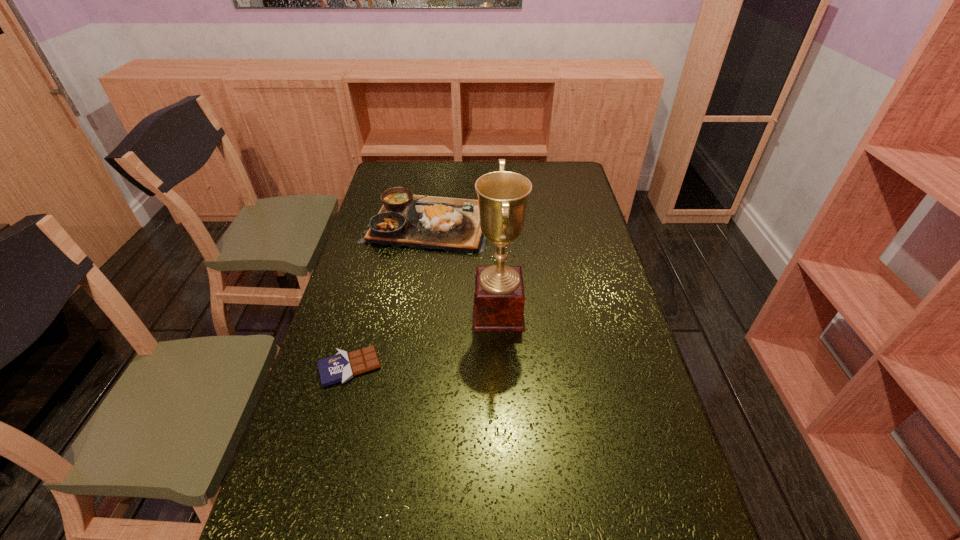
The height and width of the screenshot is (540, 960). In order to click on trophy cup in this screenshot , I will do `click(499, 298)`.

Find the location of a particular element. Image resolution: width=960 pixels, height=540 pixels. the second nearest object is located at coordinates (499, 298).

Identify the location of platter. The image size is (960, 540). (416, 221).

Locate an element on the screen. the second shortest object is located at coordinates (416, 221).

Identify the location of the nearest object. coord(343,366).

The image size is (960, 540). What are the coordinates of `chocolate bar` in the screenshot? It's located at (343, 366).

Where is `vacant area situated 0.240m on the plaque of the second nearest object`? This screenshot has width=960, height=540. vacant area situated 0.240m on the plaque of the second nearest object is located at coordinates (395, 312).

Where is `free space located on the plaque of the second nearest object`? This screenshot has height=540, width=960. free space located on the plaque of the second nearest object is located at coordinates (342, 312).

Find the location of a particular element. The height and width of the screenshot is (540, 960). free location located on the plaque of the second nearest object is located at coordinates (374, 312).

This screenshot has height=540, width=960. What are the coordinates of `vacant space located on the front of the second shortest object` in the screenshot? It's located at (421, 277).